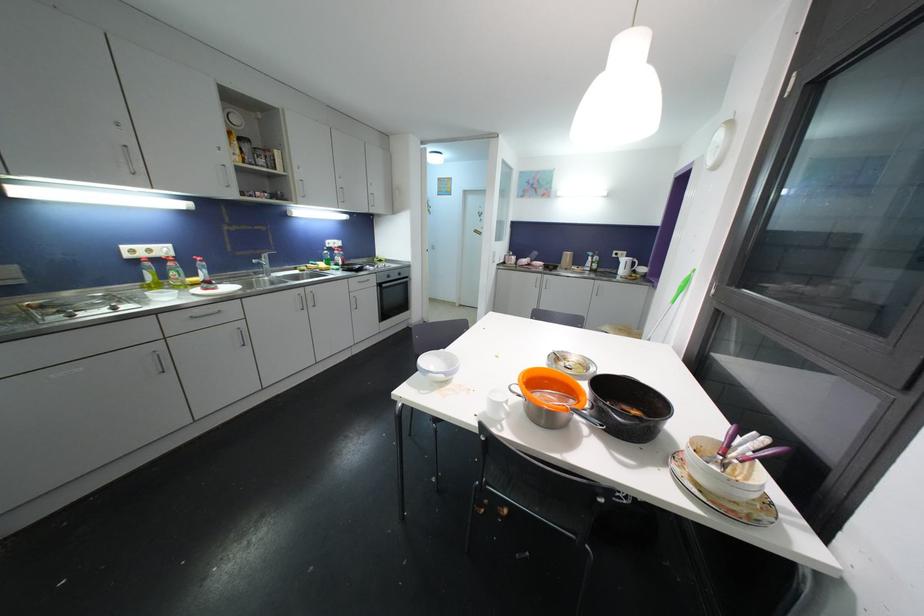
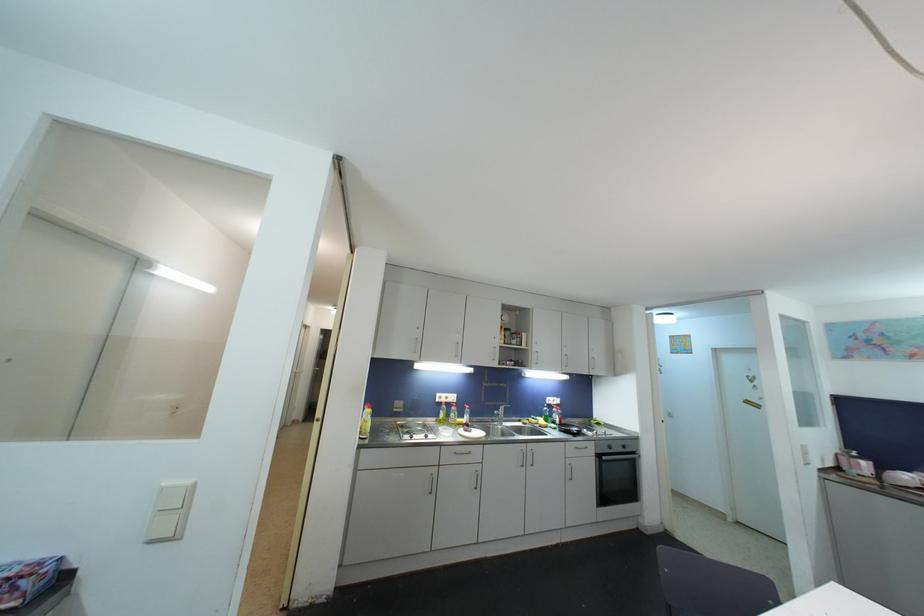
Find the pixel in the second image that matches [392,280] in the first image.

(613, 450)